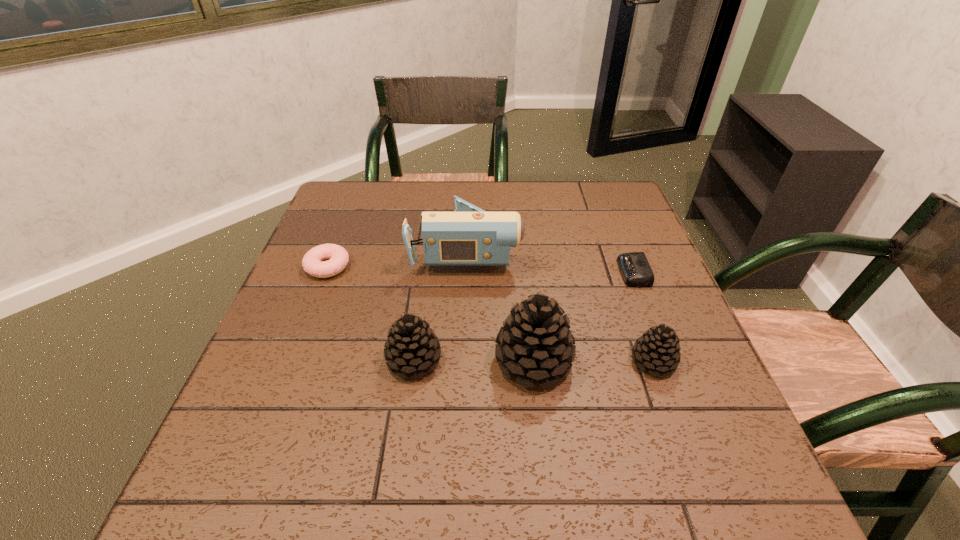
What are the coordinates of `object located at the left edge` in the screenshot? It's located at (337, 256).

Locate an element on the screen. This screenshot has width=960, height=540. pinecone that is at the right edge is located at coordinates (657, 349).

Locate an element on the screen. alarm clock present at the right edge is located at coordinates (635, 269).

You are a GUI agent. You are given a task and a screenshot of the screen. Output one action in this format:
    pyautogui.click(x=<x>, y=<y>)
    Task: Click on the vacant area at the far edge
    The width and height of the screenshot is (960, 540).
    Given the screenshot: What is the action you would take?
    pyautogui.click(x=517, y=187)

In the image, there is a desktop. Identify the location of free region at the near edge. (469, 411).

Identify the location of free space at the left edge. (274, 339).

Where is `blank area at the right edge`? The height and width of the screenshot is (540, 960). blank area at the right edge is located at coordinates [589, 231].

You are a GUI agent. You are given a task and a screenshot of the screen. Output one action in this format:
    pyautogui.click(x=<x>, y=<y>)
    Task: Click on the vacant space at the far right corner
    This screenshot has height=540, width=960.
    Given the screenshot: What is the action you would take?
    pyautogui.click(x=623, y=207)

This screenshot has width=960, height=540. What are the coordinates of `empty space that is in between the fifth tallest object and the shortest pinecone` in the screenshot? It's located at (491, 314).

Find the location of a particular element. free point between the fifth tallest object and the second tallest pinecone is located at coordinates (371, 313).